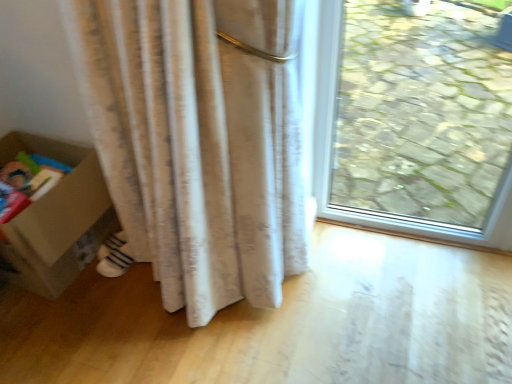
Question: From the image's perspective, is white striped socks at lower left under cardboard box at lower left?

Choices:
 (A) yes
 (B) no

Answer: (A)

Question: Is cardboard box at lower left inside white striped socks at lower left?

Choices:
 (A) yes
 (B) no

Answer: (B)

Question: Is white striped socks at lower left not near cardboard box at lower left?

Choices:
 (A) yes
 (B) no

Answer: (B)

Question: Considering the relative positions of white striped socks at lower left and cardboard box at lower left in the image provided, is white striped socks at lower left to the right of cardboard box at lower left from the viewer's perspective?

Choices:
 (A) yes
 (B) no

Answer: (A)

Question: From a real-world perspective, does white striped socks at lower left stand above cardboard box at lower left?

Choices:
 (A) no
 (B) yes

Answer: (A)

Question: Considering the relative sizes of white striped socks at lower left and cardboard box at lower left in the image provided, is white striped socks at lower left smaller than cardboard box at lower left?

Choices:
 (A) no
 (B) yes

Answer: (B)

Question: Is cardboard box at lower left looking in the opposite direction of white striped socks at lower left?

Choices:
 (A) yes
 (B) no

Answer: (B)

Question: From a real-world perspective, is cardboard box at lower left on white striped socks at lower left?

Choices:
 (A) no
 (B) yes

Answer: (B)

Question: From the image's perspective, is cardboard box at lower left located beneath white striped socks at lower left?

Choices:
 (A) yes
 (B) no

Answer: (B)

Question: Are cardboard box at lower left and white striped socks at lower left making contact?

Choices:
 (A) yes
 (B) no

Answer: (B)

Question: Can you confirm if cardboard box at lower left is wider than white striped socks at lower left?

Choices:
 (A) yes
 (B) no

Answer: (A)

Question: Can we say cardboard box at lower left lies outside white striped socks at lower left?

Choices:
 (A) no
 (B) yes

Answer: (B)

Question: From the image's perspective, is white striped socks at lower left above or below cardboard box at lower left?

Choices:
 (A) above
 (B) below

Answer: (B)